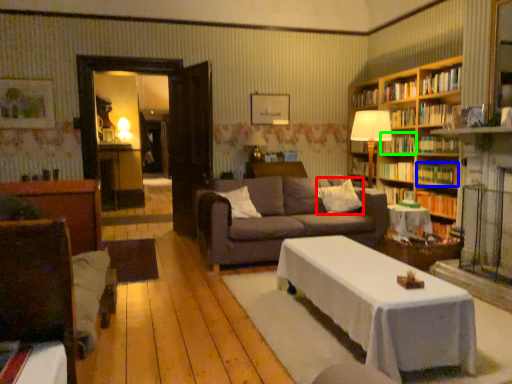
Question: Based on their relative distances, which object is nearer to pillow (highlighted by a red box)? Choose from book (highlighted by a blue box) and book (highlighted by a green box).

Choices:
 (A) book
 (B) book

Answer: (A)